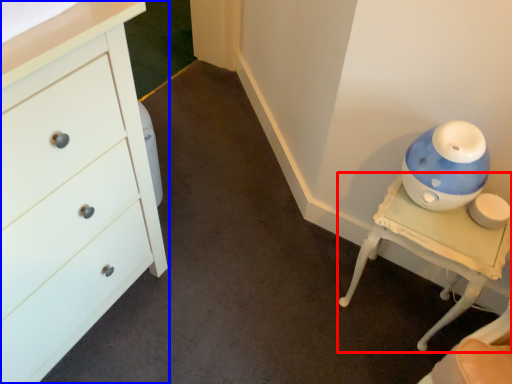
Question: Which point is closer to the camera, furniture (highlighted by a red box) or chest of drawers (highlighted by a blue box)?

Choices:
 (A) furniture
 (B) chest of drawers

Answer: (B)